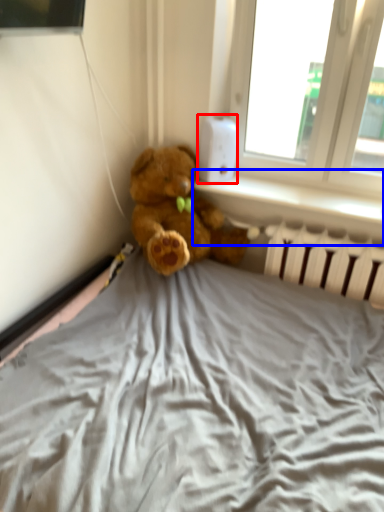
Question: Which object is closer to the camera taking this photo, thermostat (highlighted by a red box) or window sill (highlighted by a blue box)?

Choices:
 (A) thermostat
 (B) window sill

Answer: (B)